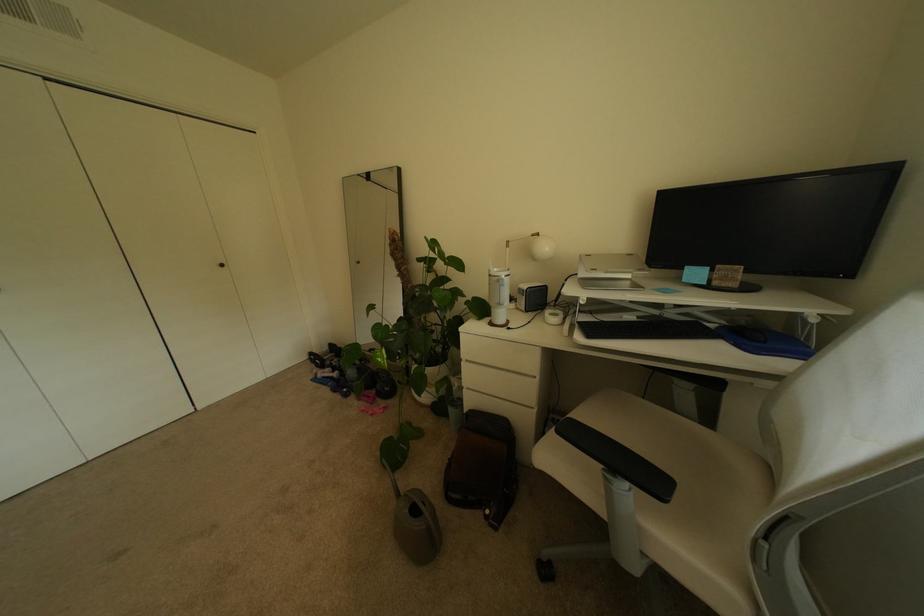
What do you see at coordinates (531, 296) in the screenshot?
I see `the black cube speaker` at bounding box center [531, 296].